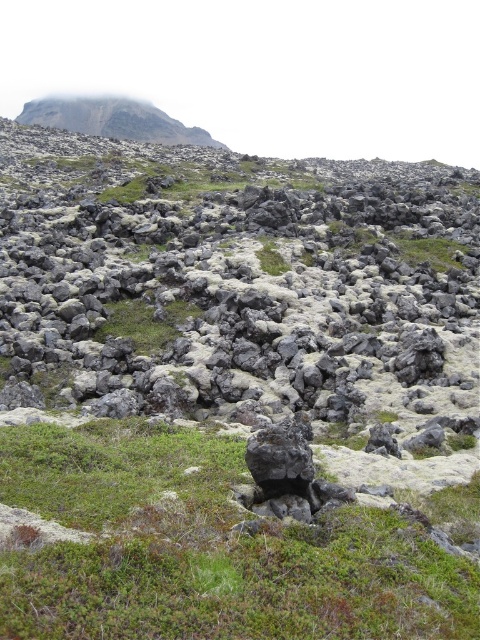
Question: Does rugged stone hillside at upper left appear under green grassy at center?

Choices:
 (A) yes
 (B) no

Answer: (B)

Question: Among these points, which one is nearest to the camera?

Choices:
 (A) (155, 323)
 (B) (167, 138)

Answer: (A)

Question: Does rugged stone hillside at upper left appear over green grassy at center?

Choices:
 (A) no
 (B) yes

Answer: (B)

Question: Which of the following is the farthest from the observer?

Choices:
 (A) green grassy at center
 (B) rugged stone hillside at upper left

Answer: (B)

Question: Can you confirm if rugged stone hillside at upper left is positioned to the right of green grassy at center?

Choices:
 (A) yes
 (B) no

Answer: (B)